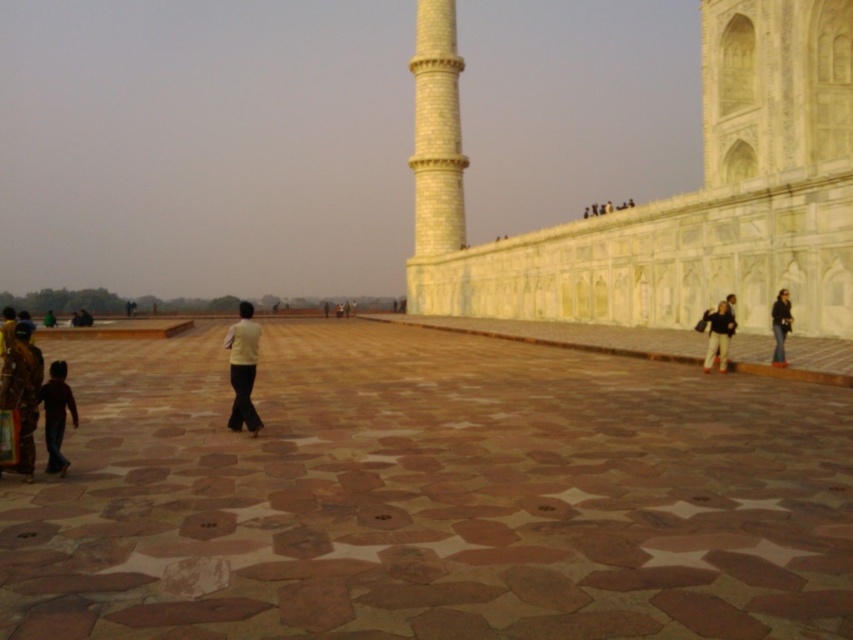
You are standing at the entrance of the plaza and see two points marked on the ground. The first point is labeled as point (242, 326) and the second is point (776, 304). Which point is closer to you?

Point (242, 326) is in front of point (776, 304), so it is closer to you.

You are standing in the plaza and want to take a photo of the minaret. There are two points marked in the image. The first is at point (506,380) and the second is at point (717,342). Which point should you stand at to have the minaret in the background and the other point in the foreground?

You should stand at point (717,342) because point (506,380) is in front of it, so placing the foreground object closer to the camera would allow the minaret to be in the background.